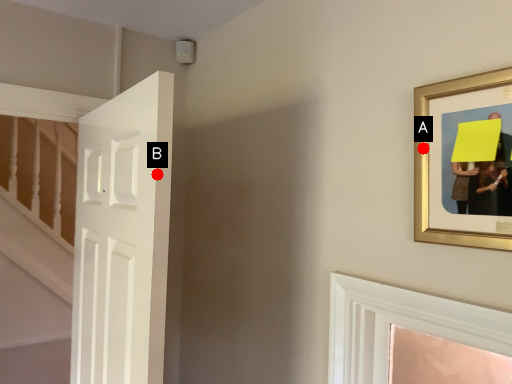
Question: Two points are circled on the image, labeled by A and B beside each circle. Which point appears farthest from the camera in this image?

Choices:
 (A) A is further
 (B) B is further

Answer: (B)